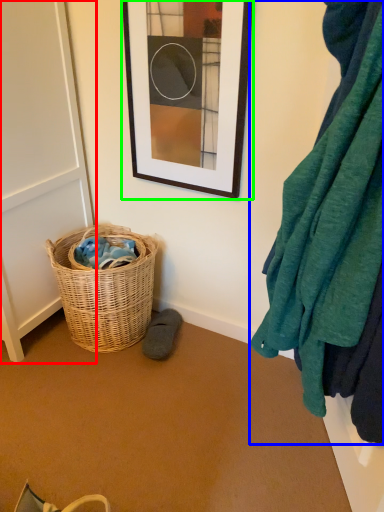
Question: Which object is the farthest from screen door (highlighted by a red box)? Choose among these: blanket (highlighted by a blue box) or picture frame (highlighted by a green box).

Choices:
 (A) blanket
 (B) picture frame

Answer: (A)